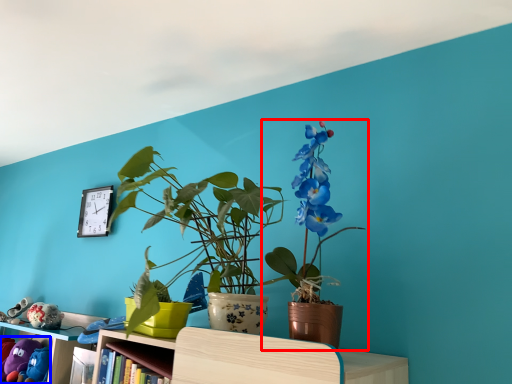
Question: Which object is closer to the camera taking this photo, houseplant (highlighted by a red box) or toy (highlighted by a blue box)?

Choices:
 (A) houseplant
 (B) toy

Answer: (A)